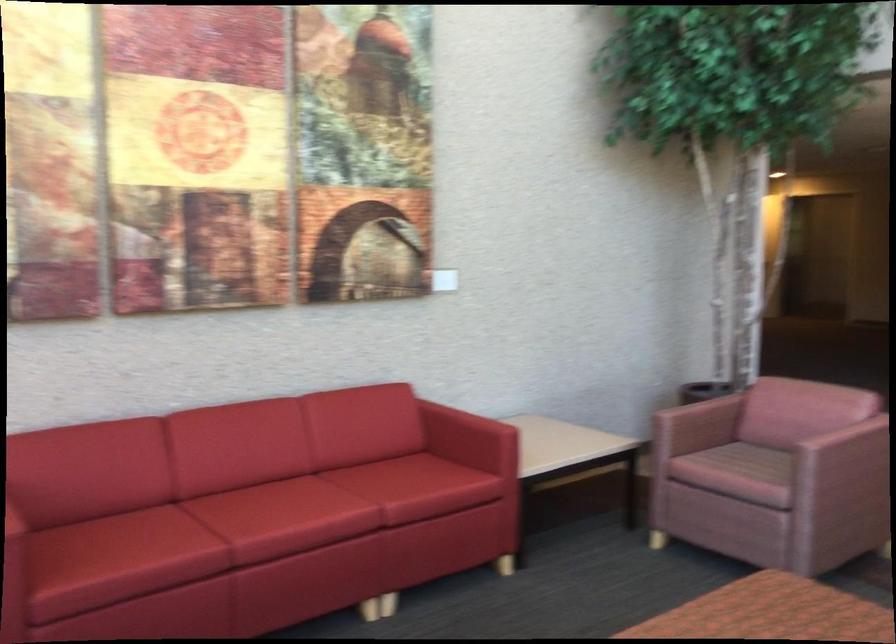
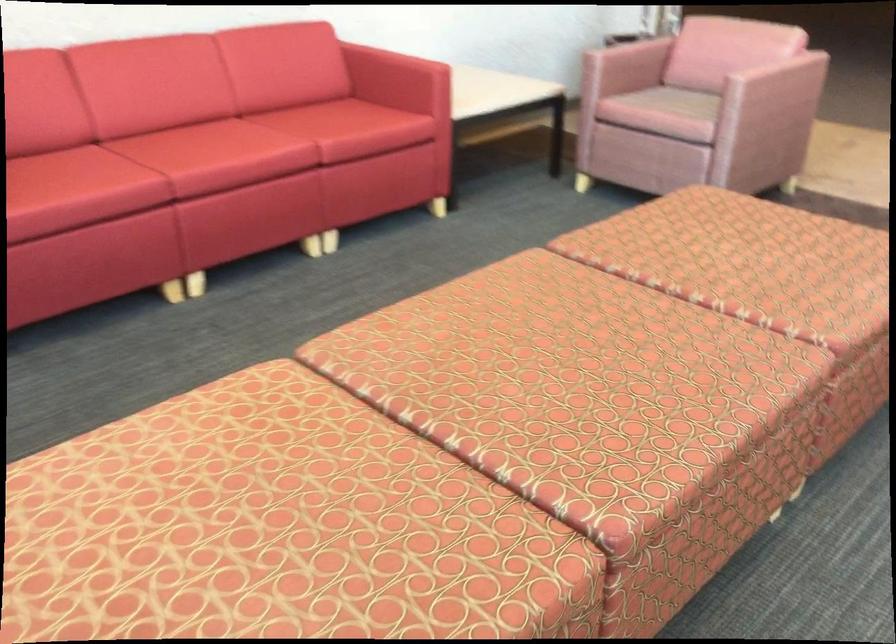
In the second image, find the point that corresponds to [702,412] in the first image.

(627, 58)